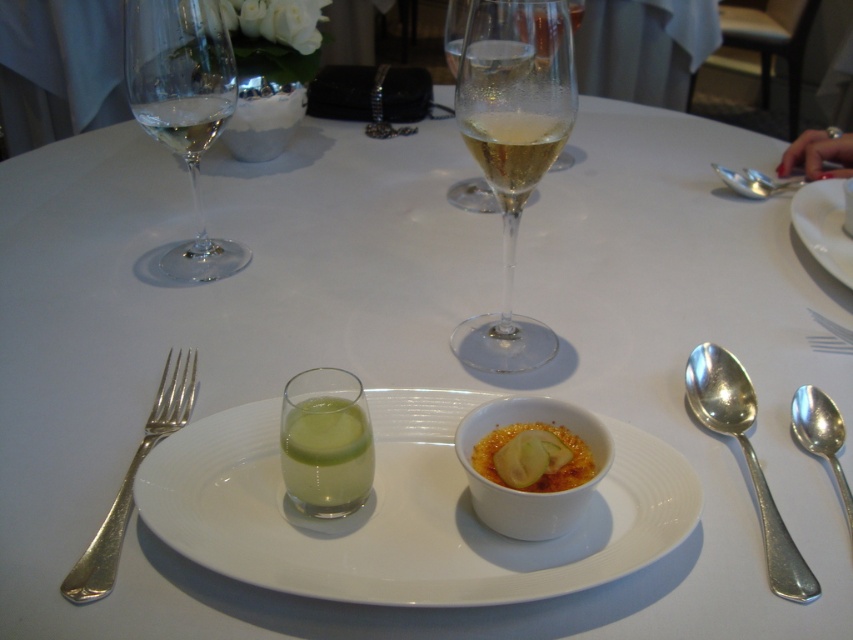
Question: Which point is farther to the camera?

Choices:
 (A) white porcelain plate at upper right
 (B) white glossy plate at center

Answer: (A)

Question: Is silver/glossy fork at left wider than clear glass wine at center?

Choices:
 (A) no
 (B) yes

Answer: (A)

Question: Does green translucent glass at center appear under white porcelain plate at upper right?

Choices:
 (A) yes
 (B) no

Answer: (A)

Question: Which object is farther from the camera taking this photo?

Choices:
 (A) silver/glossy fork at left
 (B) white glossy plate at center

Answer: (A)

Question: Which point is closer to the camera?

Choices:
 (A) (817, 420)
 (B) (724, 384)

Answer: (A)

Question: From the image, what is the correct spatial relationship of clear glass wine glass at upper center in relation to silver metallic spoon at right?

Choices:
 (A) right
 (B) left

Answer: (B)